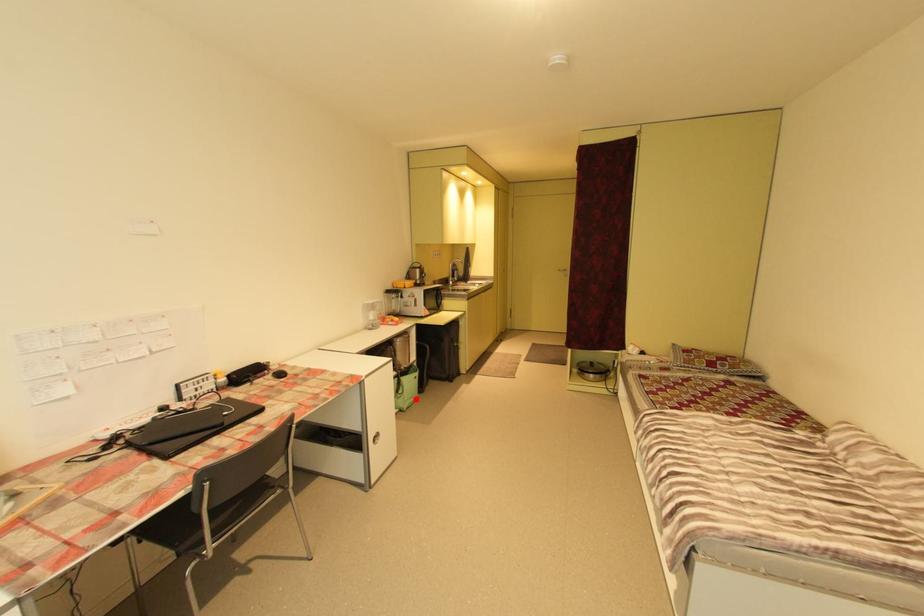
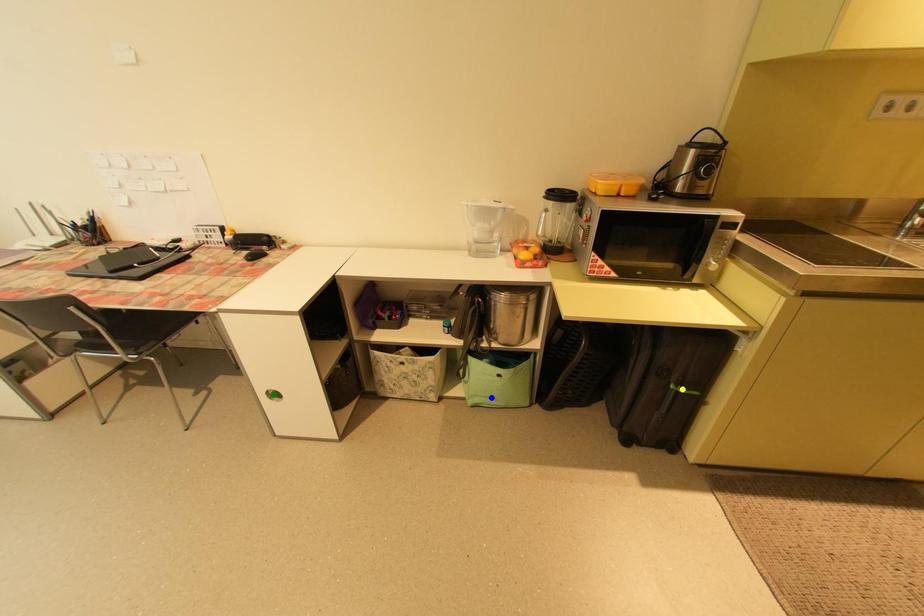
Question: I am providing you with two images of the same scene from different viewpoints. A red point is marked on the first image. You are given multiple points on the second image. Can you choose the point in image 2 that corresponds to the point in image 1?

Choices:
 (A) green point
 (B) yellow point
 (C) blue point

Answer: (C)